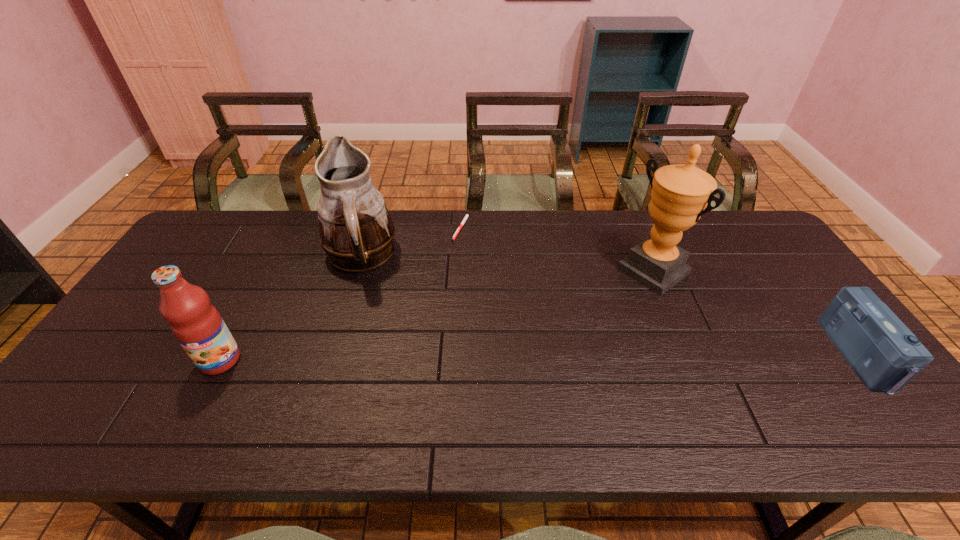
Locate an element on the screen. The image size is (960, 540). free space on the desktop that is between the fruit juice and the rightmost object and is positioned on the clicker of the third object from left to right is located at coordinates click(x=506, y=358).

At what (x,y) coordinates should I click in order to perform the action: click on vacant space on the desktop that is between the third shortest object and the rightmost object and is positioned from the spout of the pitcher. Please return your answer as a coordinate pair (x, y). Looking at the image, I should click on (533, 358).

Identify the location of vacant space on the desktop that is between the fruit juice and the camera and is positioned at the front of the fourth object from left to right with handles. (532, 358).